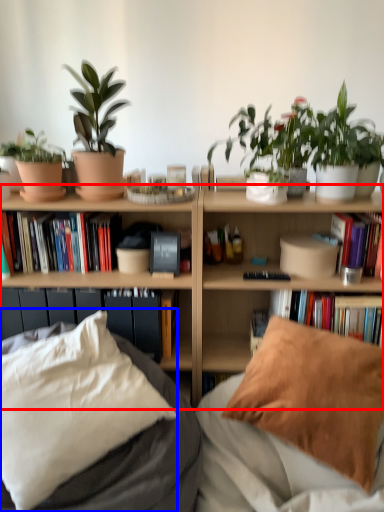
Question: Among these objects, which one is farthest to the camera, bookcase (highlighted by a red box) or pillow (highlighted by a blue box)?

Choices:
 (A) bookcase
 (B) pillow

Answer: (A)